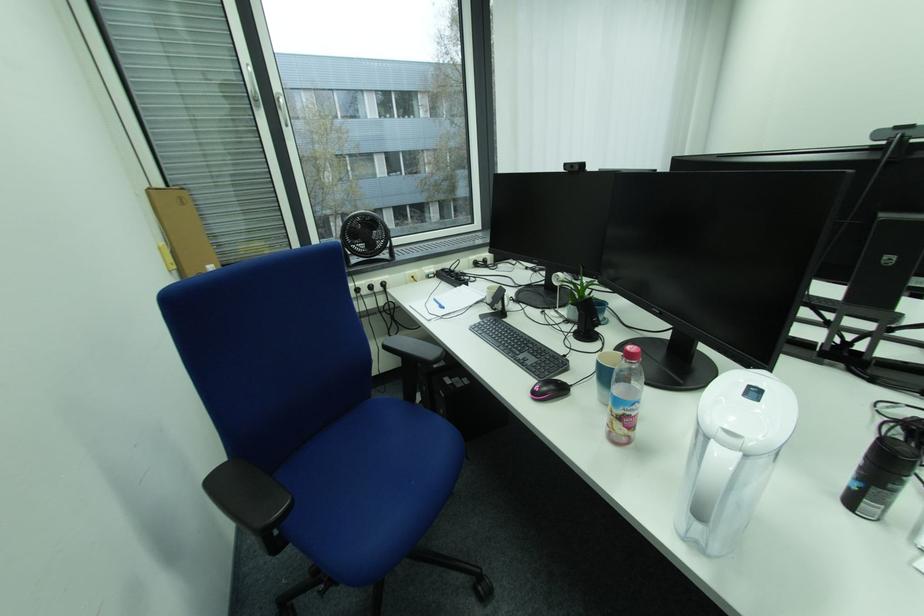
What do you see at coordinates (625, 397) in the screenshot? This screenshot has height=616, width=924. I see `the plastic water bottle` at bounding box center [625, 397].